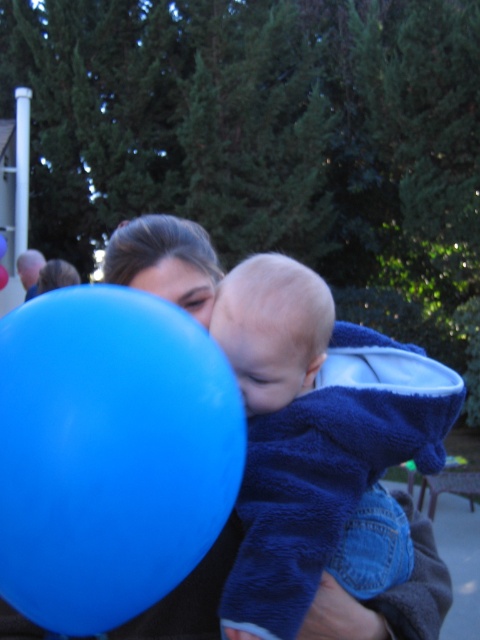
Is the position of smooth skin face at center more distant than that of blue rubber balloon at center?

No, smooth skin face at center is closer to the viewer.

Does point (295, 384) come closer to viewer compared to point (6, 276)?

Yes.

Identify the location of smooth skin face at center. Image resolution: width=480 pixels, height=640 pixels. (265, 364).

Can you confirm if smooth skin face at center is taller than matte skin face at center?

Correct, smooth skin face at center is much taller as matte skin face at center.

Where is `smooth skin face at center`? The width and height of the screenshot is (480, 640). smooth skin face at center is located at coordinates (265, 364).

Is blue soft towel at center positioned in front of smooth skin face at center?

Yes.

Can you confirm if blue soft towel at center is bigger than smooth skin face at center?

Indeed, blue soft towel at center has a larger size compared to smooth skin face at center.

Does point (275, 310) come closer to viewer compared to point (259, 356)?

That is False.

I want to click on blue soft towel at center, so click(312, 429).